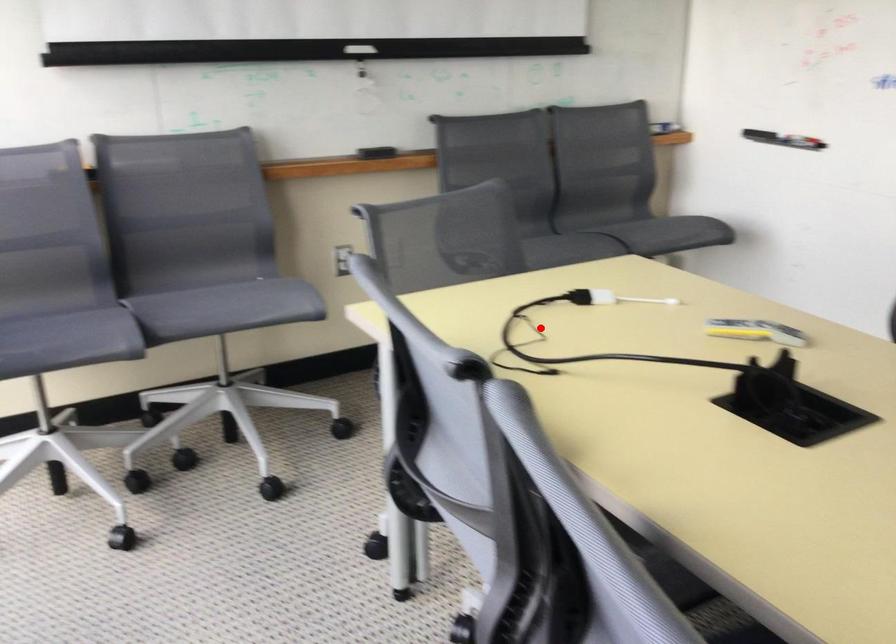
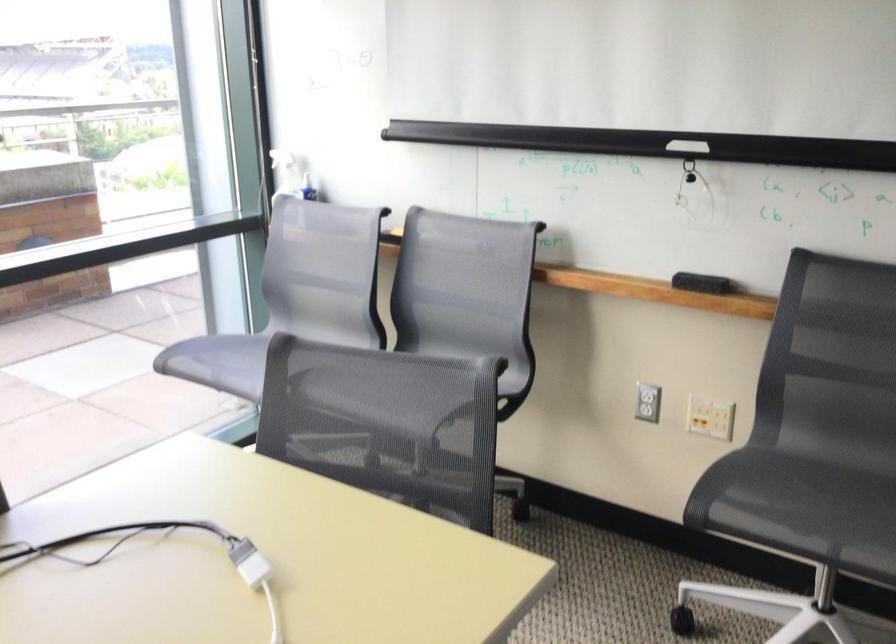
Question: I am providing you with two images of the same scene from different viewpoints. A red point is shown in image1. For the corresponding object point in image2, is it positioned nearer or farther from the camera?

Choices:
 (A) Nearer
 (B) Farther

Answer: (A)